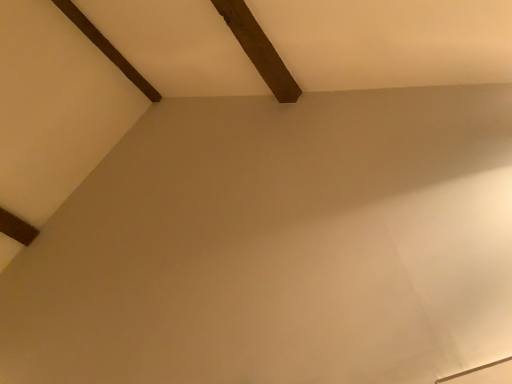
Measure the distance between point (83, 24) and camera.

Point (83, 24) is 7.55 feet from camera.

What do you see at coordinates (106, 48) in the screenshot? I see `dark brown wood at upper left` at bounding box center [106, 48].

Identify the location of dark brown wood at upper left. The width and height of the screenshot is (512, 384). (106, 48).

At what (x,y) coordinates should I click in order to perform the action: click on dark brown wood at upper left. Please return your answer as a coordinate pair (x, y). Image resolution: width=512 pixels, height=384 pixels. Looking at the image, I should click on (106, 48).